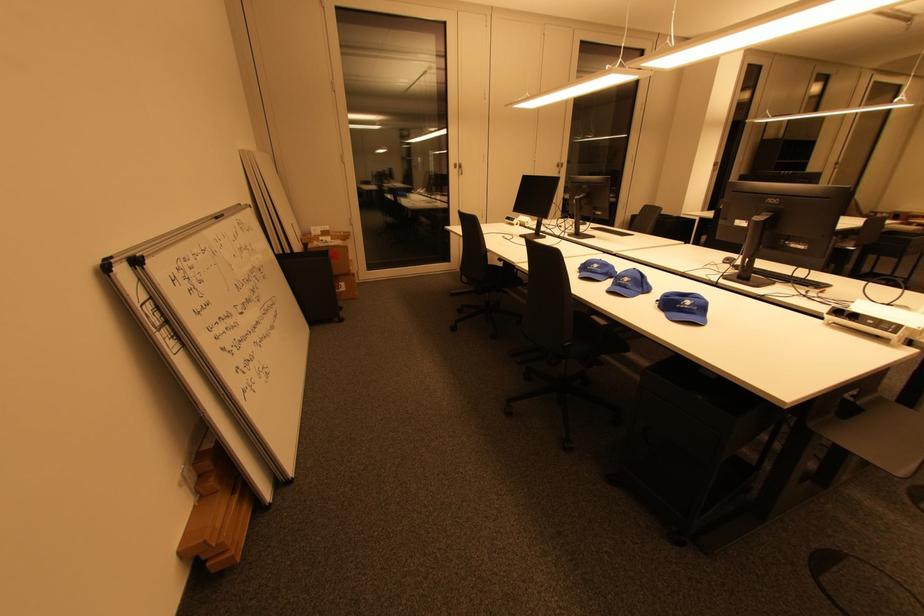
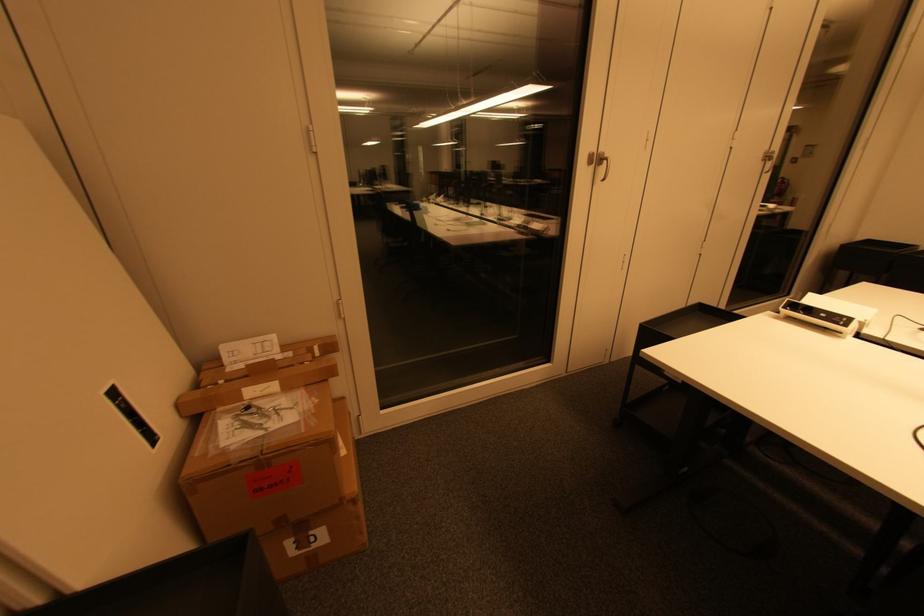
Question: What movement of the cameraman would produce the second image?

Choices:
 (A) Left
 (B) Right
 (C) Forward
 (D) Backward

Answer: (C)